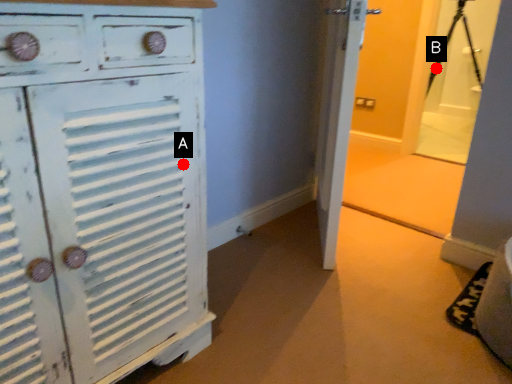
Question: Two points are circled on the image, labeled by A and B beside each circle. Which point appears closest to the camera in this image?

Choices:
 (A) A is closer
 (B) B is closer

Answer: (A)